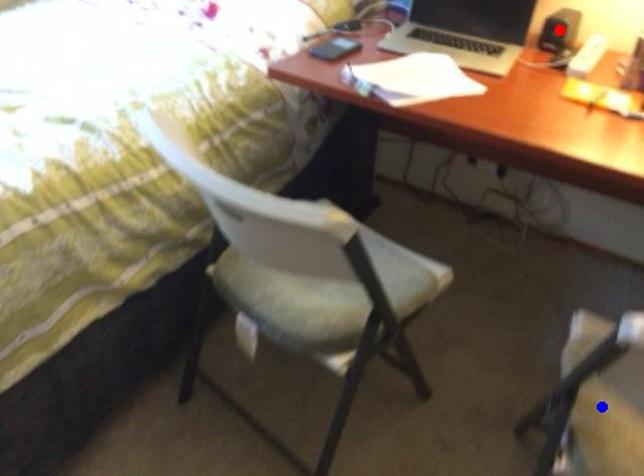
Question: In the image, two points are highlighted. Which point is nearer to the camera? Reply with the corresponding letter.

Choices:
 (A) blue point
 (B) red point

Answer: (A)